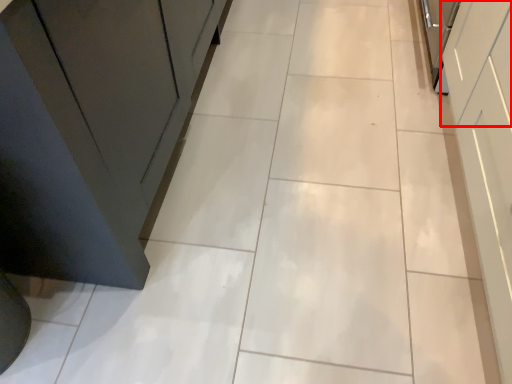
Question: From the image's perspective, where is drawer (annotated by the red box) located relative to cabinetry?

Choices:
 (A) below
 (B) above

Answer: (B)